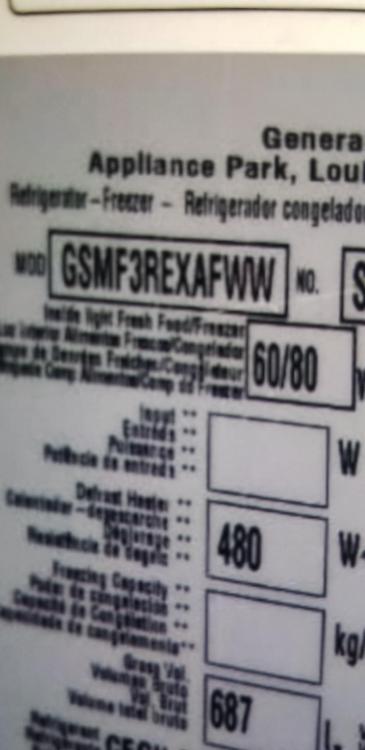
At what (x,y) coordinates should I click in order to perform the action: click on says "appliance". Please return your answer as a coordinate pair (x, y). This screenshot has width=365, height=750. Looking at the image, I should click on (122, 169).